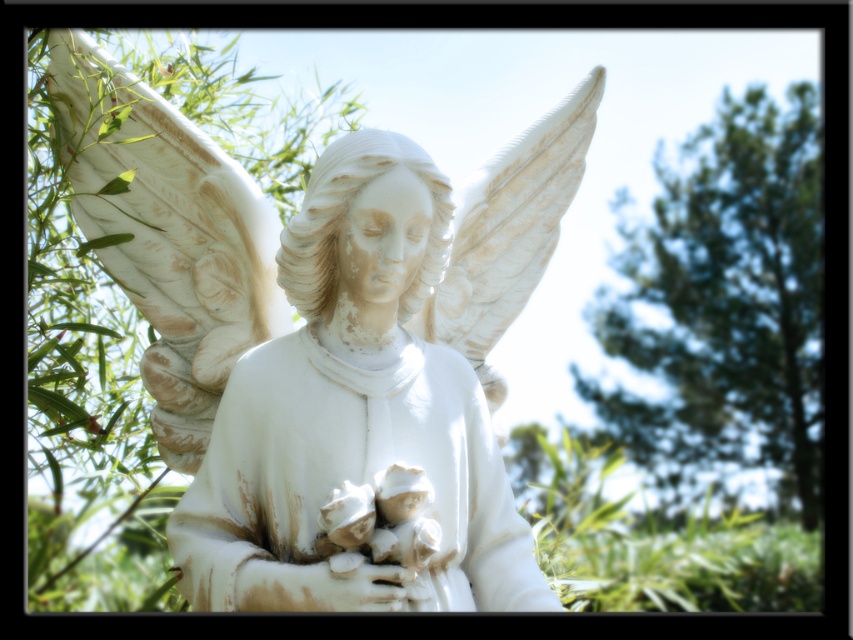
Does green leafy tree at upper right have a smaller size compared to white matte hand at center?

No.

Can you confirm if green leafy tree at upper right is positioned below white matte hand at center?

Actually, green leafy tree at upper right is above white matte hand at center.

Does point (788, 356) come closer to viewer compared to point (305, 593)?

No, (788, 356) is further to viewer.

You are a GUI agent. You are given a task and a screenshot of the screen. Output one action in this format:
    pyautogui.click(x=<x>, y=<y>)
    Task: Click on the green leafy tree at upper right
    This screenshot has width=853, height=640.
    Given the screenshot: What is the action you would take?
    pyautogui.click(x=727, y=305)

Based on the photo, does white marble statue at center lie behind white matte hand at center?

Yes, it is behind white matte hand at center.

Can you confirm if white marble statue at center is wider than white matte hand at center?

Yes.

Who is more forward, (106, 173) or (384, 609)?

Point (384, 609) is in front.

Locate an element on the screen. white marble statue at center is located at coordinates (167, 234).

Can you confirm if white marble statue at center is positioned above green leafy tree at upper right?

Correct, white marble statue at center is located above green leafy tree at upper right.

Does point (149, 115) come in front of point (721, 385)?

Yes.

You are a GUI agent. You are given a task and a screenshot of the screen. Output one action in this format:
    pyautogui.click(x=<x>, y=<y>)
    Task: Click on the white marble statue at center
    
    Given the screenshot: What is the action you would take?
    pyautogui.click(x=167, y=234)